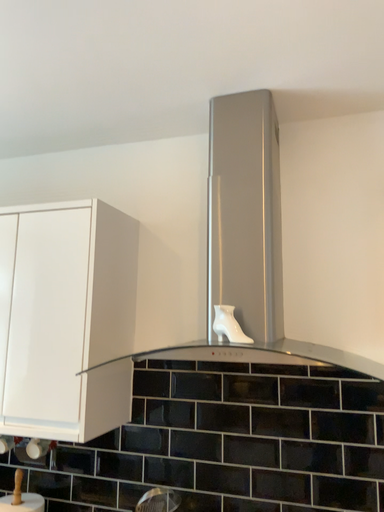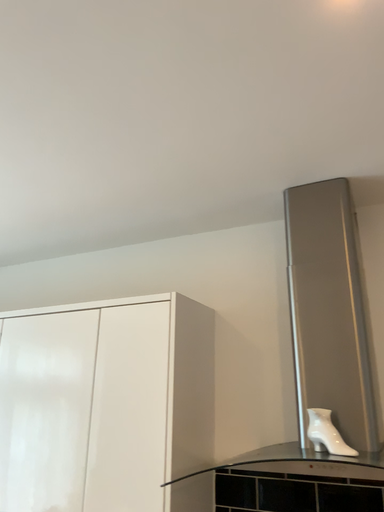
Question: How did the camera likely rotate when shooting the video?

Choices:
 (A) rotated right
 (B) rotated left

Answer: (B)